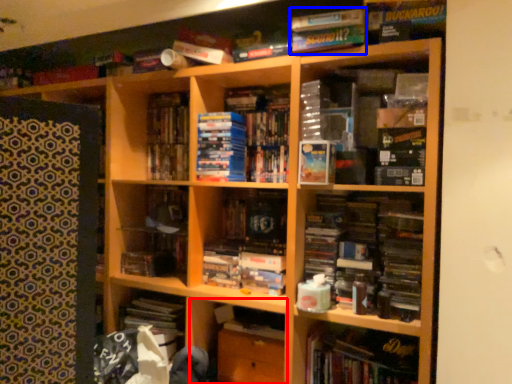
Question: Which point is further to the camera, cabinet (highlighted by a red box) or book (highlighted by a blue box)?

Choices:
 (A) cabinet
 (B) book

Answer: (A)